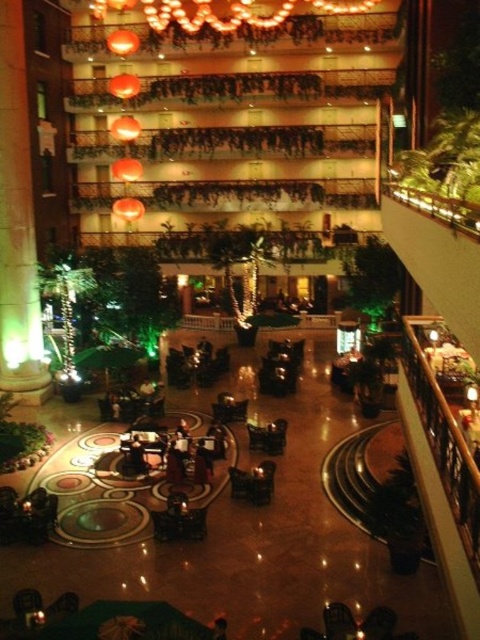
Question: Is green marble pillar at left wider than illuminated glass chandelier at upper center?

Choices:
 (A) no
 (B) yes

Answer: (A)

Question: Is green marble pillar at left to the left of illuminated glass chandelier at upper center from the viewer's perspective?

Choices:
 (A) no
 (B) yes

Answer: (B)

Question: Is green marble pillar at left behind illuminated glass chandelier at upper center?

Choices:
 (A) yes
 (B) no

Answer: (B)